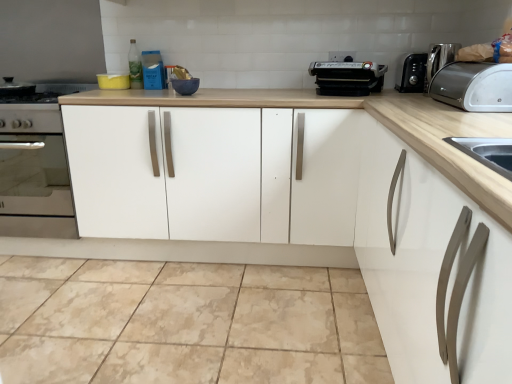
Question: Does satin silver toaster at upper right contain green glass bottle at upper center?

Choices:
 (A) no
 (B) yes

Answer: (A)

Question: From the image's perspective, is satin silver toaster at upper right above green glass bottle at upper center?

Choices:
 (A) yes
 (B) no

Answer: (B)

Question: Are satin silver toaster at upper right and green glass bottle at upper center making contact?

Choices:
 (A) yes
 (B) no

Answer: (B)

Question: Is satin silver toaster at upper right facing towards green glass bottle at upper center?

Choices:
 (A) yes
 (B) no

Answer: (A)

Question: Is satin silver toaster at upper right outside green glass bottle at upper center?

Choices:
 (A) no
 (B) yes

Answer: (B)

Question: Visually, is green glass bottle at upper center positioned to the left or to the right of black plastic grill at upper center?

Choices:
 (A) right
 (B) left

Answer: (B)

Question: Do you think green glass bottle at upper center is within black plastic grill at upper center, or outside of it?

Choices:
 (A) outside
 (B) inside

Answer: (A)

Question: Based on their sizes in the image, would you say green glass bottle at upper center is bigger or smaller than black plastic grill at upper center?

Choices:
 (A) big
 (B) small

Answer: (B)

Question: Considering the positions of green glass bottle at upper center and black plastic grill at upper center in the image, is green glass bottle at upper center taller or shorter than black plastic grill at upper center?

Choices:
 (A) tall
 (B) short

Answer: (A)

Question: Based on their sizes in the image, would you say white matte cabinet at center is bigger or smaller than green glass bottle at upper center?

Choices:
 (A) small
 (B) big

Answer: (B)

Question: From the image's perspective, is white matte cabinet at center located above or below green glass bottle at upper center?

Choices:
 (A) below
 (B) above

Answer: (A)

Question: Do you think white matte cabinet at center is within green glass bottle at upper center, or outside of it?

Choices:
 (A) inside
 (B) outside

Answer: (B)

Question: In the image, is white matte cabinet at center on the left side or the right side of green glass bottle at upper center?

Choices:
 (A) left
 (B) right

Answer: (B)

Question: Relative to green glass bottle at upper center, is satin silver toaster at upper right in front or behind?

Choices:
 (A) front
 (B) behind

Answer: (A)

Question: From their relative heights in the image, would you say satin silver toaster at upper right is taller or shorter than green glass bottle at upper center?

Choices:
 (A) tall
 (B) short

Answer: (B)